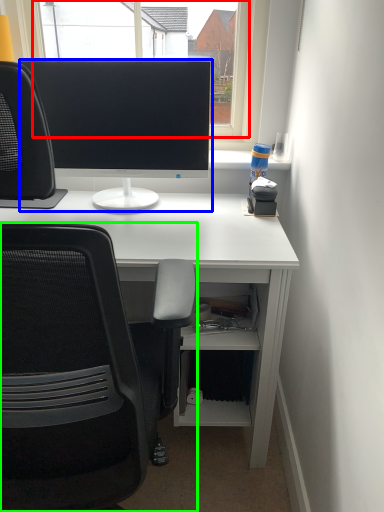
Question: Based on their relative distances, which object is farther from window screen (highlighted by a red box)? Choose from computer monitor (highlighted by a blue box) and chair (highlighted by a green box).

Choices:
 (A) computer monitor
 (B) chair

Answer: (B)